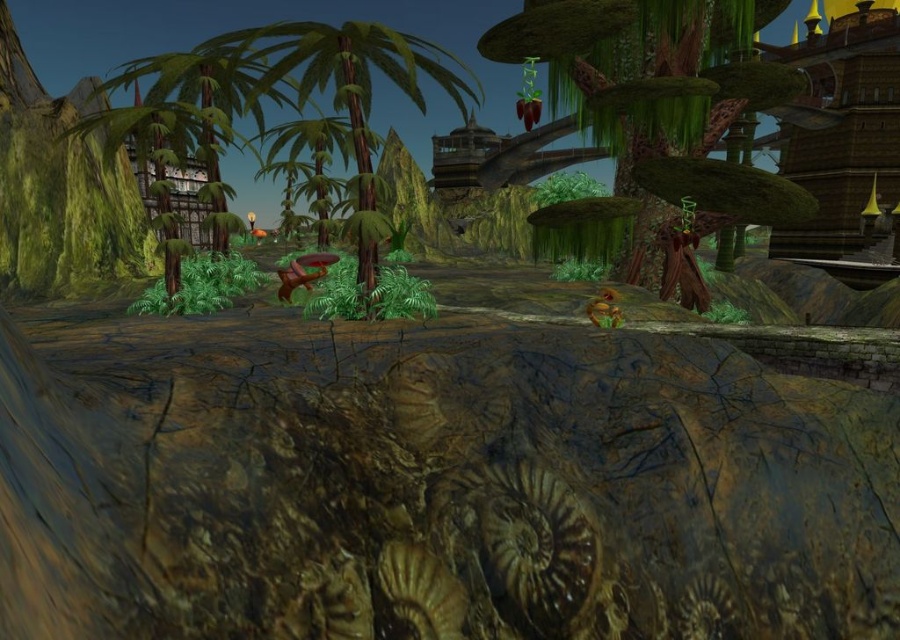
Question: Does green mossy tree at center appear under green matte palm tree at center?

Choices:
 (A) yes
 (B) no

Answer: (A)

Question: Which of the following is the closest to the observer?

Choices:
 (A) green mossy tree at center
 (B) green matte palm tree at center

Answer: (B)

Question: Where is green mossy tree at center located in relation to green matte palm tree at center in the image?

Choices:
 (A) below
 (B) above

Answer: (A)

Question: Is green mossy tree at center to the left of green matte palm tree at center from the viewer's perspective?

Choices:
 (A) no
 (B) yes

Answer: (A)

Question: Which point appears closest to the camera in this image?

Choices:
 (A) (574, 77)
 (B) (261, 28)

Answer: (B)